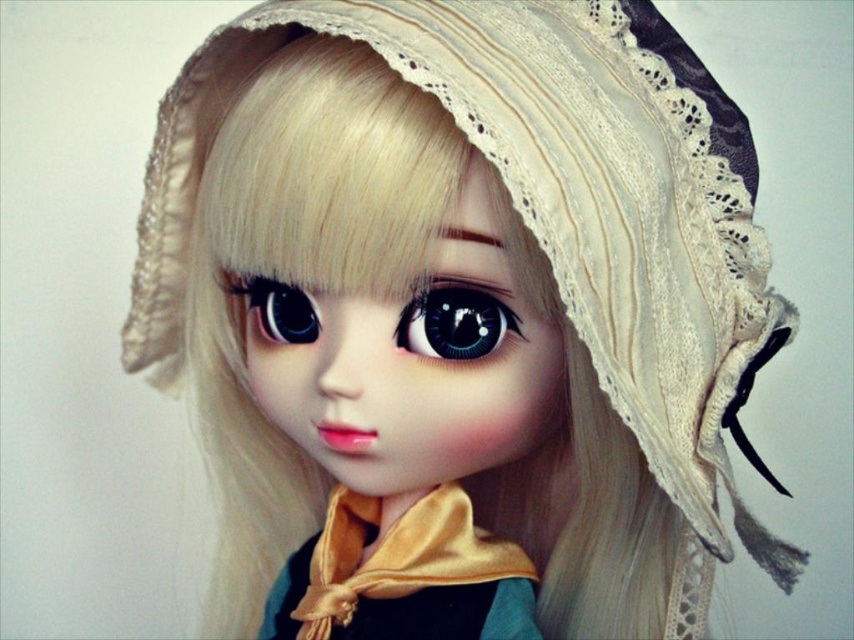
Who is positioned more to the left, gold satin scarf at center or glossy black eye at center?

gold satin scarf at center is more to the left.

Is point (335, 566) farther from camera compared to point (437, 284)?

Yes.

Image resolution: width=854 pixels, height=640 pixels. Find the location of `gold satin scarf at center`. gold satin scarf at center is located at coordinates (402, 577).

Does point (366, 540) come in front of point (290, 308)?

No.

What do you see at coordinates (402, 577) in the screenshot? I see `gold satin scarf at center` at bounding box center [402, 577].

This screenshot has width=854, height=640. What are the coordinates of `gold satin scarf at center` in the screenshot? It's located at (402, 577).

Image resolution: width=854 pixels, height=640 pixels. Describe the element at coordinates (454, 321) in the screenshot. I see `glossy black eye at center` at that location.

Which is more to the right, glossy black eye at center or satin eye at center?

glossy black eye at center

At what (x,y) coordinates should I click in order to perform the action: click on glossy black eye at center. Please return your answer as a coordinate pair (x, y). Looking at the image, I should click on (454, 321).

Locate an element on the screen. The image size is (854, 640). glossy black eye at center is located at coordinates (454, 321).